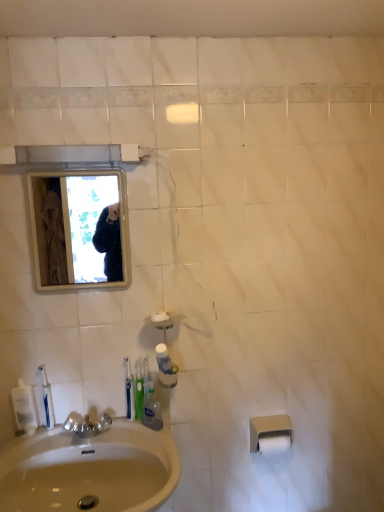
At what (x,y) coordinates should I click in order to perform the action: click on space that is in front of clear plastic mouthwash at lower left, the 2th mouthwash when ordered from left to right. Please return your answer as a coordinate pair (x, y). This screenshot has height=512, width=384. Looking at the image, I should click on (34, 446).